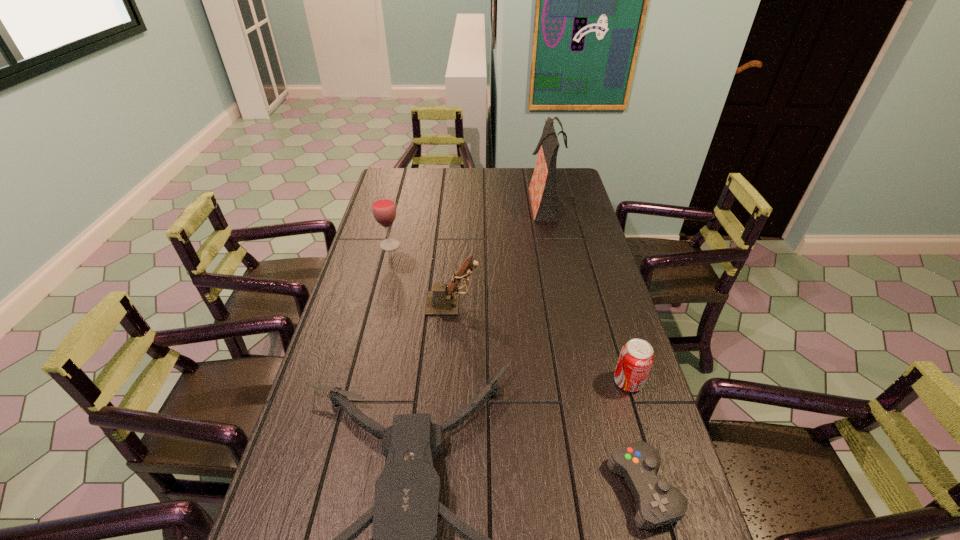
Locate an element on the screen. The height and width of the screenshot is (540, 960). free space between the soda and the wineglass is located at coordinates (509, 313).

Locate which object ranks third in proximity to the third farthest object. Please provide its 2D coordinates. Your answer should be formatted as a tuple, i.e. [(x, y)], where the tuple contains the x and y coordinates of a point satisfying the conditions above.

[(636, 358)]

Identify which object is the third closest to the shopping bag. Please provide its 2D coordinates. Your answer should be formatted as a tuple, i.e. [(x, y)], where the tuple contains the x and y coordinates of a point satisfying the conditions above.

[(636, 358)]

In order to click on vacant area that satisfies the following two spatial constraints: 1. on the front side of the soda; 2. on the left side of the farthest object in this screenshot , I will do `click(581, 382)`.

In order to click on free space that satisfies the following two spatial constraints: 1. on the front side of the control; 2. on the right side of the tallest object in this screenshot , I will do `click(603, 489)`.

In order to click on blank area in the image that satisfies the following two spatial constraints: 1. on the back side of the shortest object; 2. on the front side of the farthest object in this screenshot , I will do (565, 202).

Locate an element on the screen. blank space that satisfies the following two spatial constraints: 1. on the back side of the shortest object; 2. on the front-facing side of the figurine is located at coordinates (593, 303).